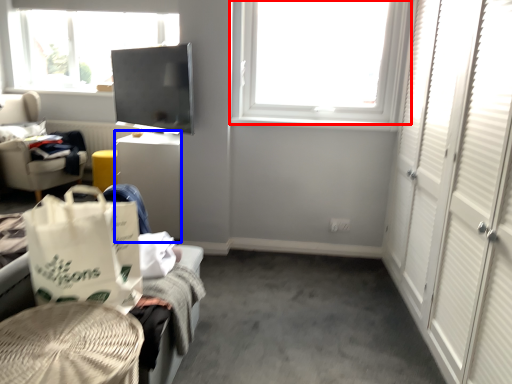
Question: Which point is closer to the camera, window (highlighted by a red box) or desk (highlighted by a blue box)?

Choices:
 (A) window
 (B) desk

Answer: (A)